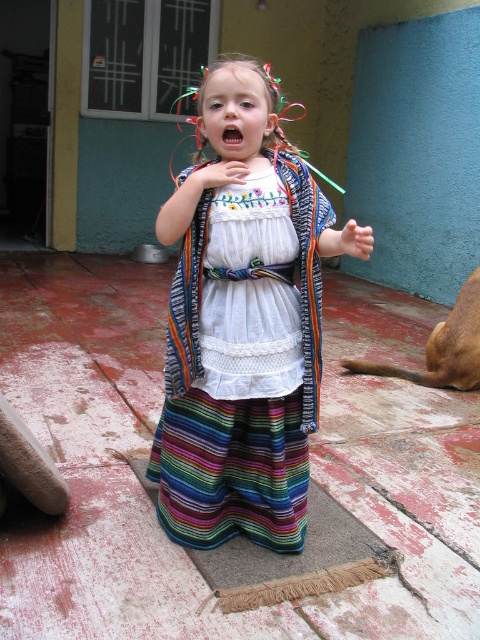
Who is more forward, (289, 163) or (222, 196)?

Positioned in front is point (222, 196).

Is point (195, 205) positioned after point (203, 305)?

No, it is not.

Locate an element on the screen. striped cotton dress at center is located at coordinates (242, 323).

The width and height of the screenshot is (480, 640). What are the coordinates of `white embroidered dress at center` in the screenshot? It's located at (250, 339).

Where is `white embroidered dress at center`? This screenshot has height=640, width=480. white embroidered dress at center is located at coordinates (250, 339).

The width and height of the screenshot is (480, 640). I want to click on white embroidered dress at center, so click(250, 339).

Can you confirm if striped cotton dress at center is positioned above brown fur dog at lower right?

Correct, striped cotton dress at center is located above brown fur dog at lower right.

Find the location of a particular element. striped cotton dress at center is located at coordinates (242, 323).

This screenshot has height=640, width=480. Describe the element at coordinates (242, 323) in the screenshot. I see `striped cotton dress at center` at that location.

Locate an element on the screen. The height and width of the screenshot is (640, 480). striped cotton dress at center is located at coordinates (242, 323).